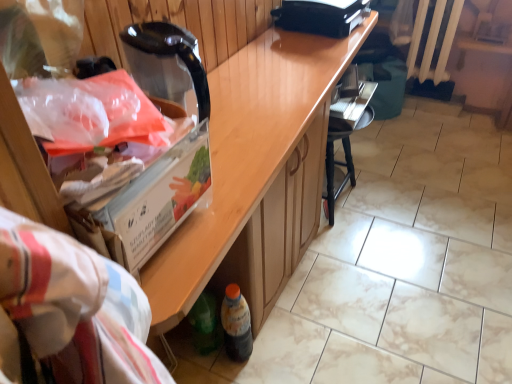
Question: Is wooden cabinet at center placed right next to black plastic printer at upper center?

Choices:
 (A) yes
 (B) no

Answer: (B)

Question: From a real-world perspective, is wooden cabinet at center positioned under black plastic printer at upper center based on gravity?

Choices:
 (A) yes
 (B) no

Answer: (A)

Question: Is wooden cabinet at center bigger than black plastic printer at upper center?

Choices:
 (A) yes
 (B) no

Answer: (A)

Question: Is wooden cabinet at center positioned behind black plastic printer at upper center?

Choices:
 (A) yes
 (B) no

Answer: (B)

Question: Is wooden cabinet at center far away from black plastic printer at upper center?

Choices:
 (A) yes
 (B) no

Answer: (B)

Question: From a real-world perspective, is wooden cabinet at center on black plastic printer at upper center?

Choices:
 (A) yes
 (B) no

Answer: (B)

Question: Is black plastic printer at upper center turned away from translucent plastic bottle at lower center?

Choices:
 (A) no
 (B) yes

Answer: (A)

Question: Are black plastic printer at upper center and translucent plastic bottle at lower center beside each other?

Choices:
 (A) yes
 (B) no

Answer: (B)

Question: From the image's perspective, is black plastic printer at upper center beneath translucent plastic bottle at lower center?

Choices:
 (A) no
 (B) yes

Answer: (A)

Question: From a real-world perspective, is black plastic printer at upper center physically above translucent plastic bottle at lower center?

Choices:
 (A) yes
 (B) no

Answer: (A)

Question: Considering the relative positions of black plastic printer at upper center and translucent plastic bottle at lower center in the image provided, is black plastic printer at upper center to the right of translucent plastic bottle at lower center from the viewer's perspective?

Choices:
 (A) yes
 (B) no

Answer: (A)

Question: Does black plastic printer at upper center come in front of translucent plastic bottle at lower center?

Choices:
 (A) yes
 (B) no

Answer: (B)

Question: Does white painted metal radiator at upper right have a lesser width compared to black plastic printer at upper center?

Choices:
 (A) yes
 (B) no

Answer: (A)